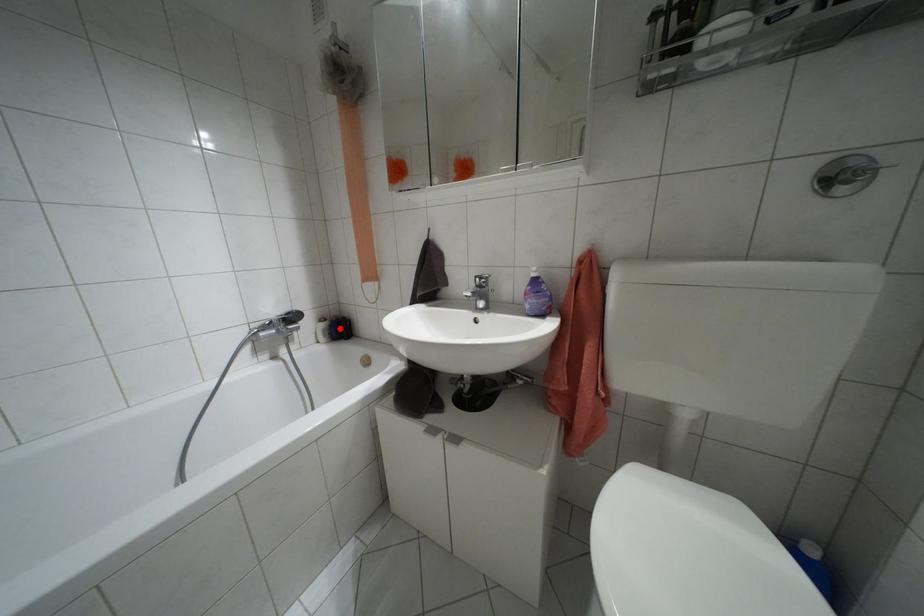
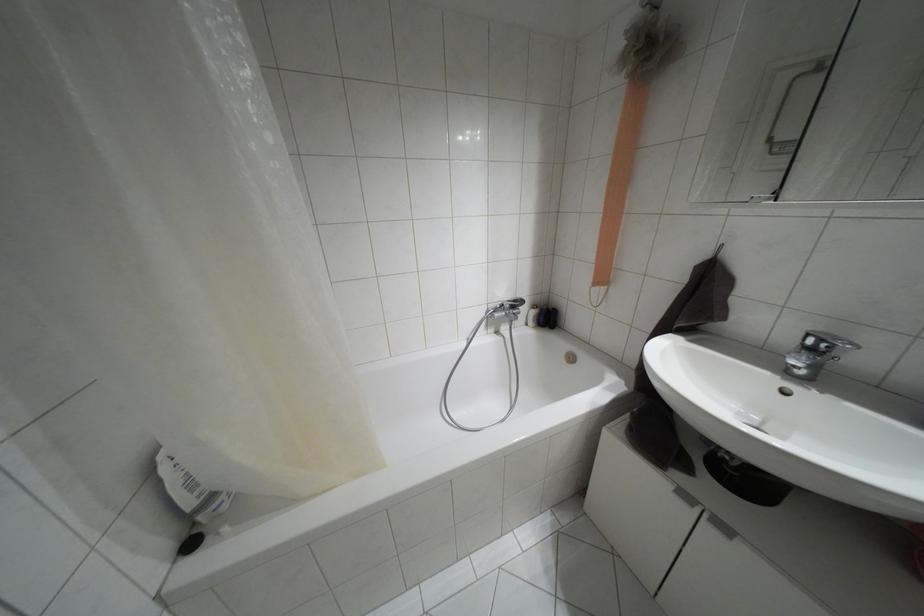
Locate, in the second image, the point that corresponds to the highlighted location in the first image.

(546, 317)